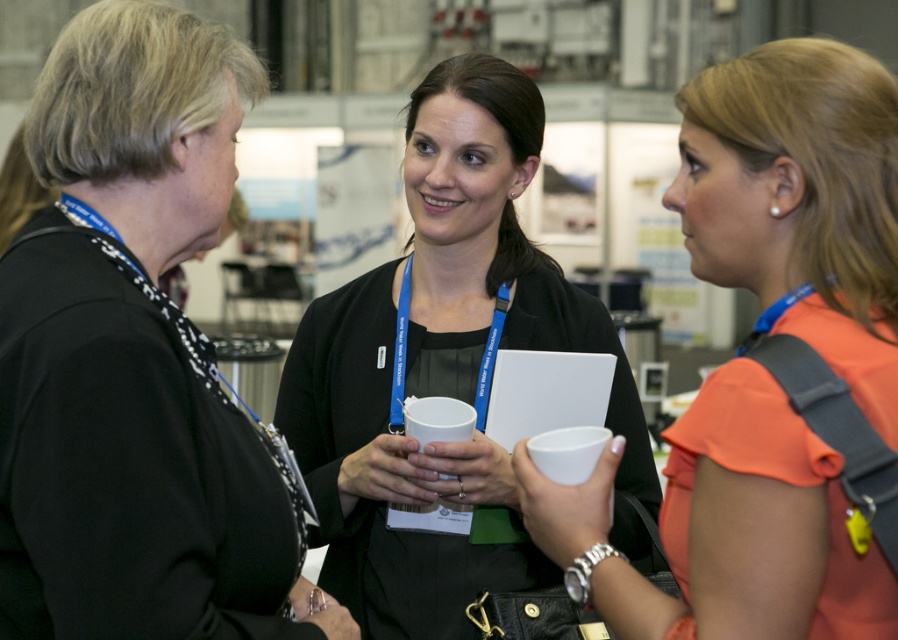
You are a photographer standing at the front of the room. You want to take a photo of the black fabric jacket at upper left without including the woman on the right. Given that the jacket is 1.42 meters away from you, can you step back to ensure the woman on the right is out of frame?

The black fabric jacket at upper left is 1.42 meters away from the camera. By stepping back, you can increase the distance, which would reduce the jacket and the woman on the right in the frame proportionally. However, since the exact position of the woman on the right isn not specified, it is uncertain if stepping back alone will exclude her from the photo. Adjusting your angle or position might be more effective to frame the jacket without the woman on the right.

You are organizing a clothing donation drive and need to pack items into boxes. You have a box that can only accommodate items up to 10 cm in thickness. You have the black fabric jacket at upper left and the orange fabric dress at right. Which item can fit into the box based on their thickness?

The black fabric jacket at upper left is thinner than the orange fabric dress at right, so the black fabric jacket at upper left can fit into the box since it meets the thickness requirement.